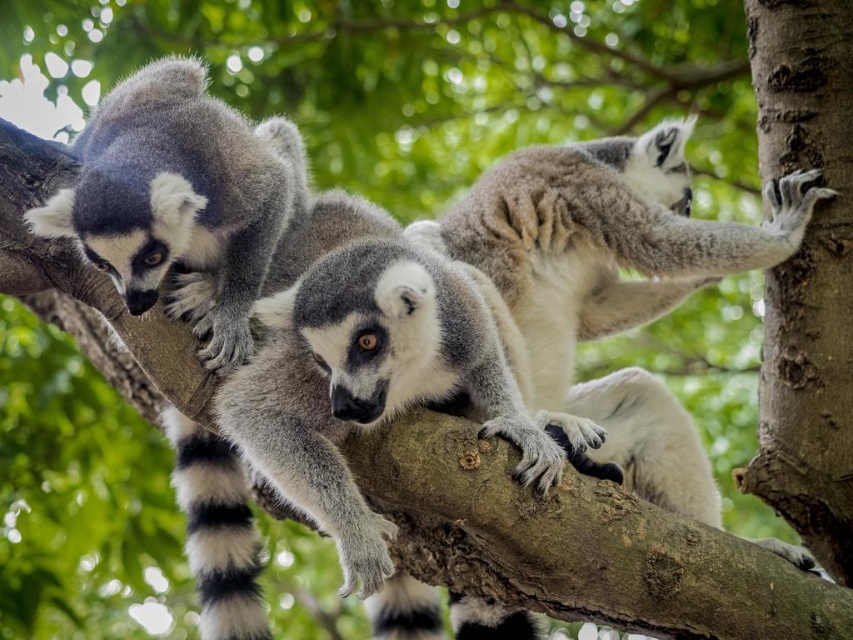
Looking at this image, you are a photographer trying to capture a closeup of the lemurs. You notice two points marked in the image. From your perspective, which point is closer to you, point (x=169, y=186) or point (x=225, y=476)?

Point (x=169, y=186) is in front of point (x=225, y=476), so it is closer to you.